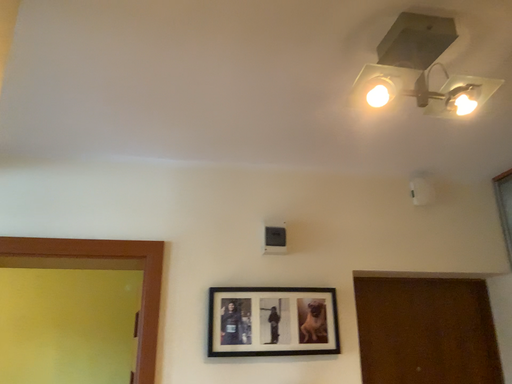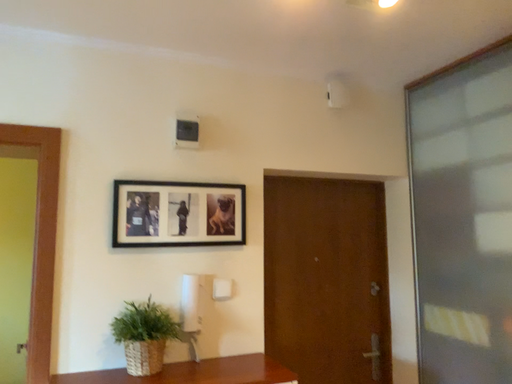
Question: How did the camera likely rotate when shooting the video?

Choices:
 (A) rotated right
 (B) rotated left

Answer: (A)